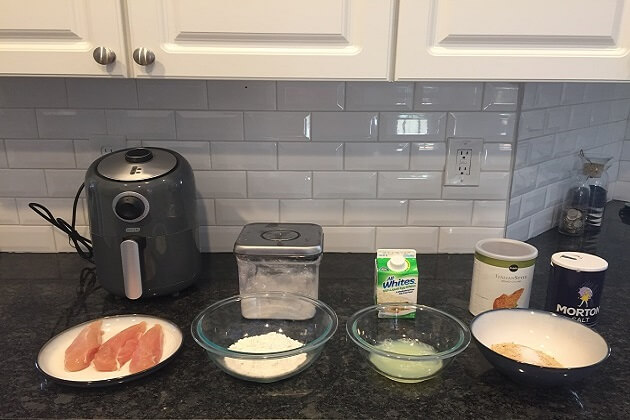
At what (x,y) coordinates should I click in order to perform the action: click on black marbel countertop. Please return your answer as a coordinate pair (x, y). Looking at the image, I should click on (481, 381).